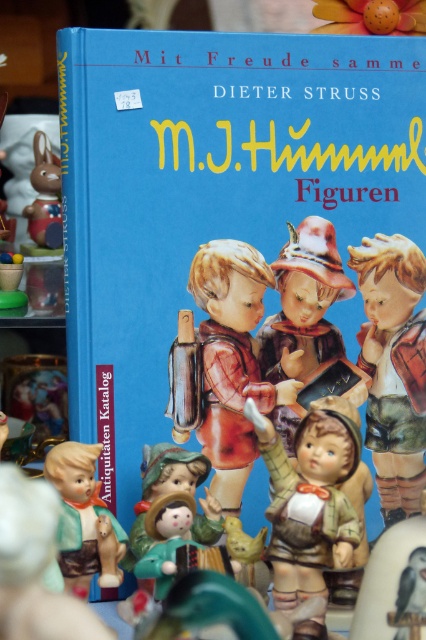
Question: From the image, what is the correct spatial relationship of matte porcelain figurine at center-right in relation to matte ceramic rabbit at upper left?

Choices:
 (A) above
 (B) below

Answer: (B)

Question: Is matte porcelain child at center further to the viewer compared to white matte bird at center?

Choices:
 (A) yes
 (B) no

Answer: (A)

Question: Considering the real-world distances, which object is closest to the matte porcelain child at center?

Choices:
 (A) matte brown figurine at center
 (B) matte porcelain figurine at center-right

Answer: (B)

Question: Which object is closer to the camera taking this photo?

Choices:
 (A) matte porcelain child at center
 (B) matte porcelain figurine at center-right
 (C) white matte bird at center

Answer: (C)

Question: Can you confirm if matte porcelain doll at center is positioned to the left of matte porcelain doll at lower left?

Choices:
 (A) yes
 (B) no

Answer: (B)

Question: Which of these objects is positioned closest to the white matte bird at center?

Choices:
 (A) matte porcelain child at center
 (B) matte brown figurine at center
 (C) matte porcelain figurine at center-right

Answer: (B)